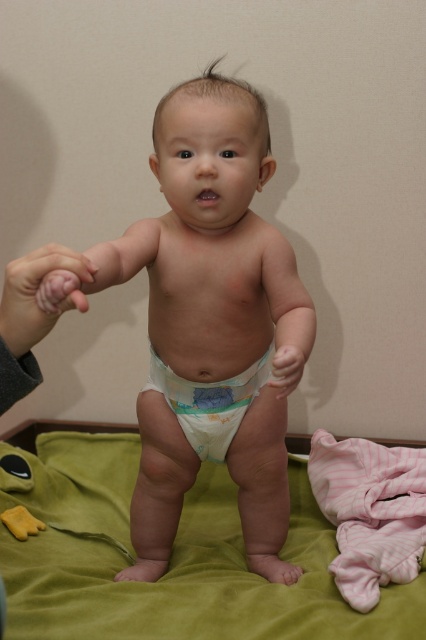
Question: Which object is closer to the camera taking this photo?

Choices:
 (A) white disposable diaper at center
 (B) green velvety bed at center
 (C) yellow rubber duck at lower left

Answer: (B)

Question: Is white disposable diaper at center smaller than pink soft skin at left?

Choices:
 (A) no
 (B) yes

Answer: (A)

Question: Which point is closer to the camera?

Choices:
 (A) (49, 326)
 (B) (126, 246)
 (C) (250, 403)
 (D) (160, 586)

Answer: (A)

Question: Among these points, which one is nearest to the camera?

Choices:
 (A) (377, 620)
 (B) (140, 577)
 (C) (26, 512)
 (D) (17, 353)

Answer: (D)

Question: Can you confirm if white cloth diaper at center is positioned to the left of yellow rubber duck at lower left?

Choices:
 (A) no
 (B) yes

Answer: (A)

Question: Observing the image, what is the correct spatial positioning of green velvety bed at center in reference to white disposable diaper at center?

Choices:
 (A) above
 (B) below

Answer: (B)